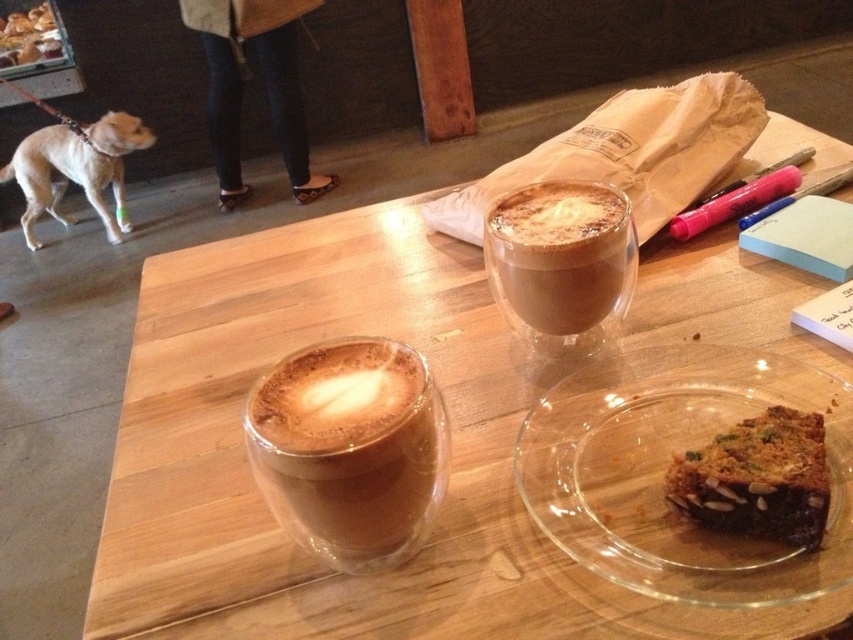
Which is in front, point (573, 413) or point (776, 451)?

Point (776, 451) is in front.

Image resolution: width=853 pixels, height=640 pixels. What are the coordinates of `clear glass plate at lower right` in the screenshot? It's located at click(x=666, y=467).

Where is `cappuccino glass at center`? cappuccino glass at center is located at coordinates (350, 449).

Measure the distance between point [340,458] and camera.

Point [340,458] is 13.66 inches from camera.

Is point (428, 513) in front of point (35, 188)?

That is True.

The image size is (853, 640). Find the location of `cappuccino glass at center`. cappuccino glass at center is located at coordinates (350, 449).

Between clear glass plate at lower right and light brown fur at left, which one has more height?

Standing taller between the two is light brown fur at left.

Is clear glass plate at lower right thinner than light brown fur at left?

Yes, clear glass plate at lower right is thinner than light brown fur at left.

In order to click on clear glass plate at lower right in this screenshot , I will do `click(666, 467)`.